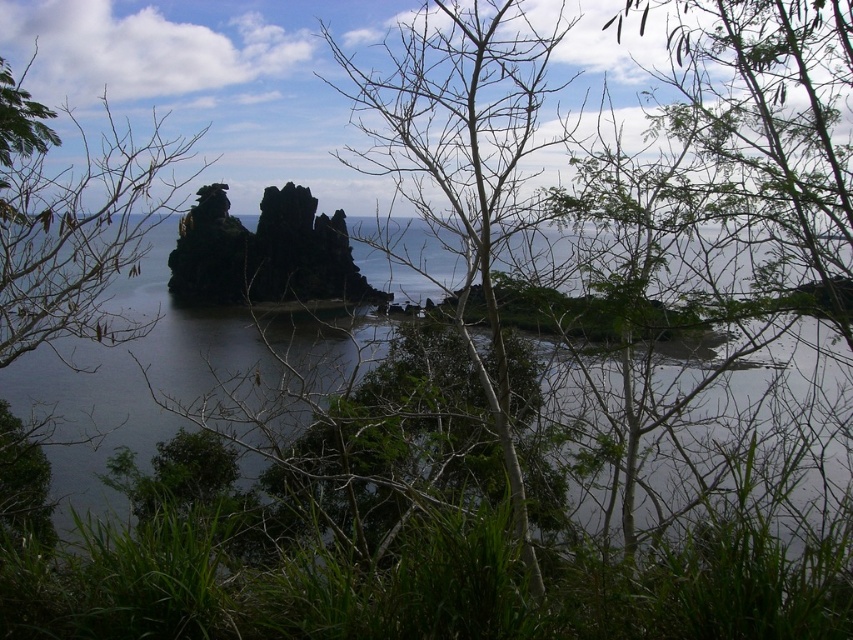
Is brown leafless branches at upper left closer to the viewer compared to dark brown rock formation at center?

Yes.

Can you confirm if brown leafless branches at upper left is bigger than dark brown rock formation at center?

Correct, brown leafless branches at upper left is larger in size than dark brown rock formation at center.

Image resolution: width=853 pixels, height=640 pixels. I want to click on brown leafless branches at upper left, so [74, 221].

Who is more distant from viewer, (711, 404) or (326, 237)?

Positioned behind is point (326, 237).

You are a GUI agent. You are given a task and a screenshot of the screen. Output one action in this format:
    pyautogui.click(x=<x>, y=<y>)
    Task: Click on the transparent water at center
    The image size is (853, 640).
    Given the screenshot: What is the action you would take?
    pyautogui.click(x=180, y=376)

Can you confirm if bare branches at center is smaller than brown leafless branches at upper left?

No.

This screenshot has width=853, height=640. Identify the location of bare branches at center. pyautogui.click(x=463, y=157).

The height and width of the screenshot is (640, 853). In order to click on bare branches at center in this screenshot , I will do `click(463, 157)`.

Find the location of a particular element. The height and width of the screenshot is (640, 853). bare branches at center is located at coordinates (463, 157).